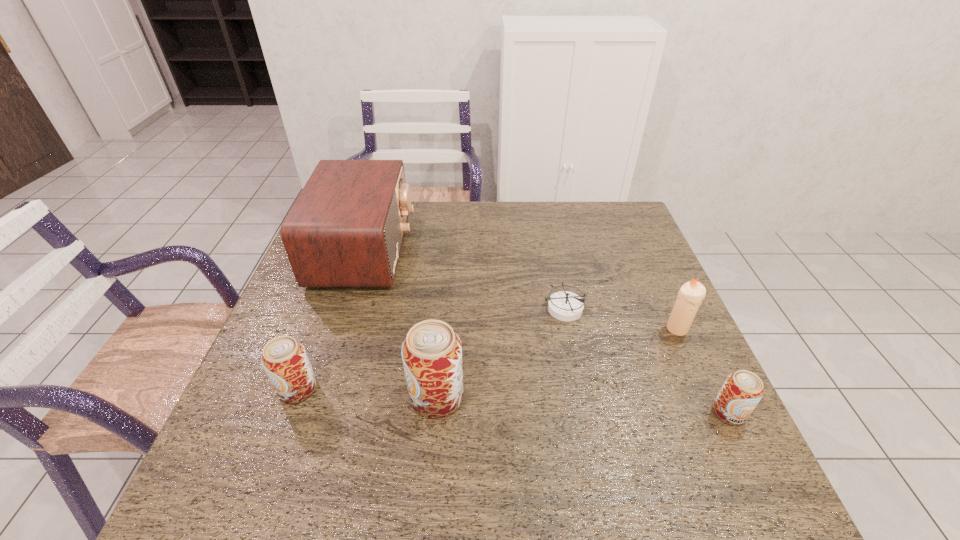
Locate which beer can is the second closest to the candle. Please provide its 2D coordinates. Your answer should be formatted as a tuple, i.e. [(x, y)], where the tuple contains the x and y coordinates of a point satisfying the conditions above.

[(432, 352)]

Select which beer can is the second closest to the third object from right to left. Please provide its 2D coordinates. Your answer should be formatted as a tuple, i.e. [(x, y)], where the tuple contains the x and y coordinates of a point satisfying the conditions above.

[(741, 392)]

This screenshot has height=540, width=960. I want to click on vacant space that satisfies the following two spatial constraints: 1. on the back side of the compass; 2. on the left side of the second shortest beer can, so click(x=327, y=309).

You are a GUI agent. You are given a task and a screenshot of the screen. Output one action in this format:
    pyautogui.click(x=<x>, y=<y>)
    Task: Click on the vacant area in the image that satisfies the following two spatial constraints: 1. on the front panel of the farthest object; 2. on the left side of the candle
    The image size is (960, 540).
    Given the screenshot: What is the action you would take?
    pyautogui.click(x=340, y=329)

You are a GUI agent. You are given a task and a screenshot of the screen. Output one action in this format:
    pyautogui.click(x=<x>, y=<y>)
    Task: Click on the free space that satisfies the following two spatial constraints: 1. on the back side of the candle; 2. on the front panel of the farthest object
    
    Given the screenshot: What is the action you would take?
    pyautogui.click(x=642, y=251)

Where is `vacant space that satisfies the following two spatial constraints: 1. on the front panel of the candle; 2. on the right side of the radio receiver`? The height and width of the screenshot is (540, 960). vacant space that satisfies the following two spatial constraints: 1. on the front panel of the candle; 2. on the right side of the radio receiver is located at coordinates (340, 329).

Identify the location of vacant position in the image that satisfies the following two spatial constraints: 1. on the front panel of the radio receiver; 2. on the right side of the shortest object. Image resolution: width=960 pixels, height=540 pixels. (346, 309).

What are the coordinates of `vacant space that satisfies the following two spatial constraints: 1. on the back side of the leftmost beer can; 2. on the right side of the third object from right to left` in the screenshot? It's located at (327, 309).